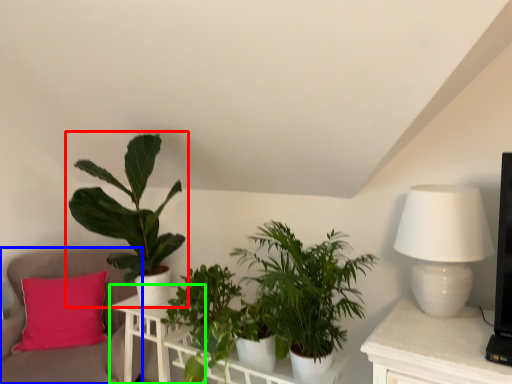
Question: Considering the real-world distances, which object is closest to houseplant (highlighted by a red box)? swivel chair (highlighted by a blue box) or table (highlighted by a green box).

Choices:
 (A) swivel chair
 (B) table

Answer: (B)